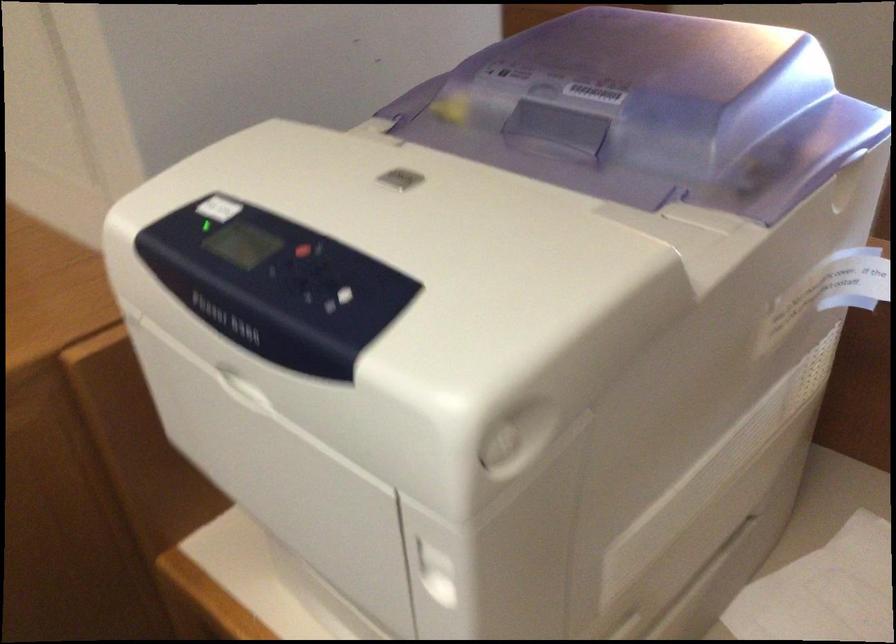
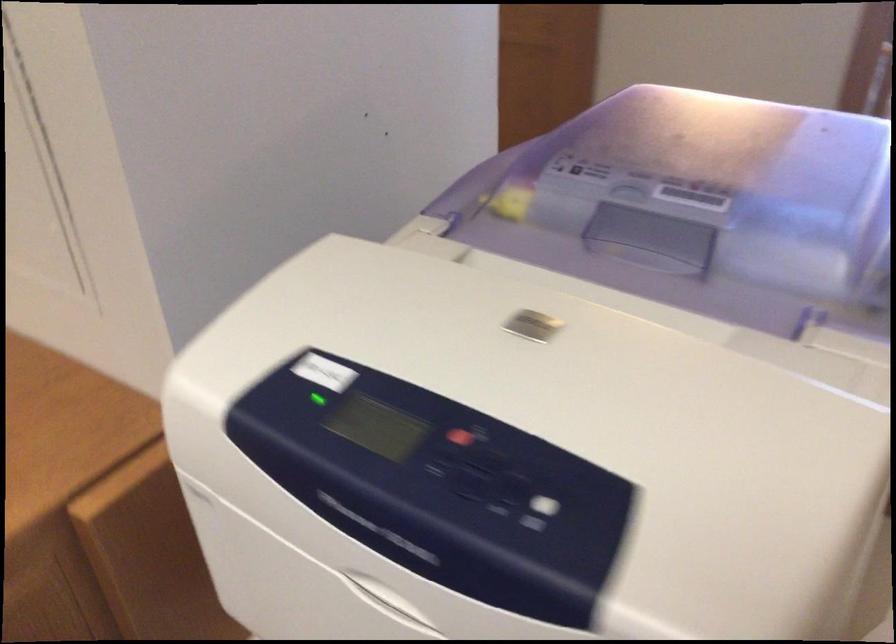
Locate, in the second image, the point that corresponds to pixel 409 182 in the first image.

(539, 325)